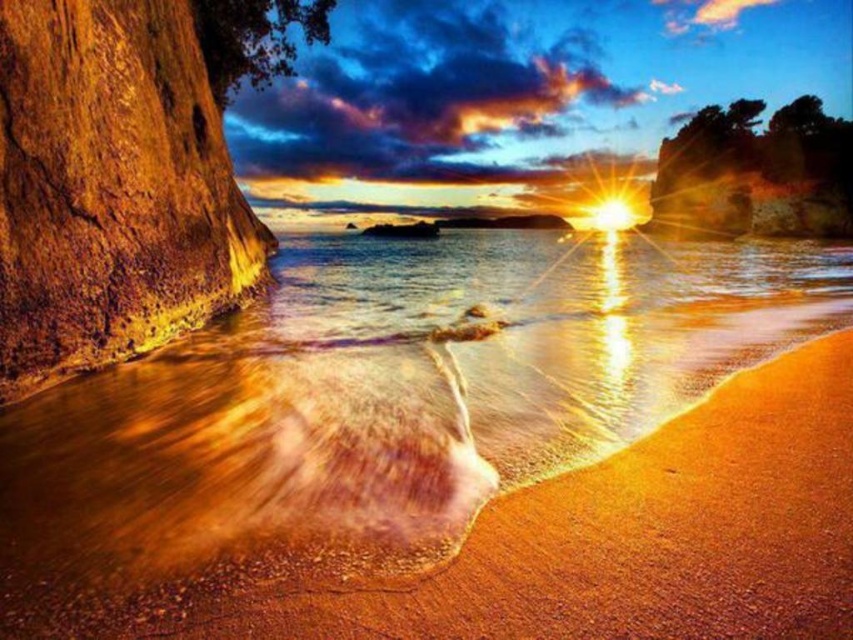
From the picture: You are standing on the beach looking at the golden sand at lower center and the rusty wood rock at left. Which object is nearer to you?

The golden sand at lower center is closer to the viewer than the rusty wood rock at left.

Consider the image. You are standing at the edge of the beach and want to walk towards the golden sand at lower center. There is a rusty wood rock at left in your path. Based on the scene description, which object occupies more horizontal space from left to right?

The golden sand at lower center might be wider than rusty wood rock at left, so it likely occupies more horizontal space from left to right.